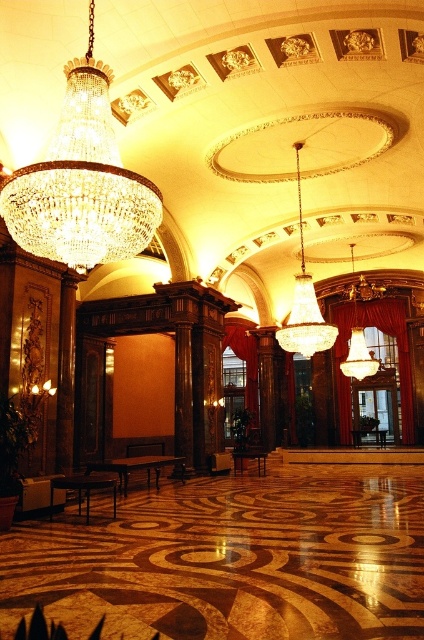
Question: Considering the real-world distances, which object is farthest from the matte gold chandelier at center?

Choices:
 (A) crystal glass chandelier at upper left
 (B) crystal chandelier at center

Answer: (A)

Question: Does crystal glass chandelier at upper left have a smaller size compared to matte gold chandelier at center?

Choices:
 (A) no
 (B) yes

Answer: (A)

Question: Is crystal glass chandelier at upper left smaller than matte gold chandelier at center?

Choices:
 (A) no
 (B) yes

Answer: (A)

Question: Is crystal glass chandelier at upper left to the right of matte gold chandelier at center from the viewer's perspective?

Choices:
 (A) yes
 (B) no

Answer: (B)

Question: Among these points, which one is nearest to the camera?

Choices:
 (A) (111, 172)
 (B) (353, 371)
 (C) (334, 336)

Answer: (A)

Question: Which object is closer to the camera taking this photo?

Choices:
 (A) crystal glass chandelier at upper left
 (B) matte gold chandelier at center

Answer: (A)